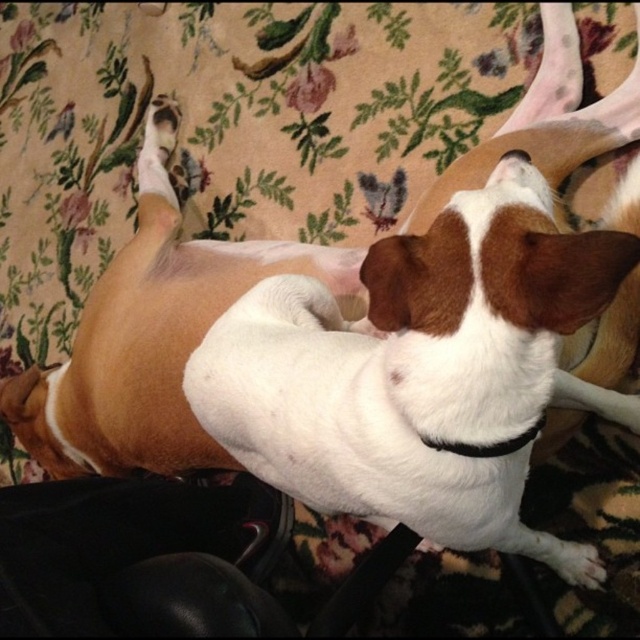
Question: Is white fur dog at center smaller than black fabric neckband at center?

Choices:
 (A) no
 (B) yes

Answer: (A)

Question: Where is white fur dog at center located in relation to black fabric neckband at center in the image?

Choices:
 (A) left
 (B) right

Answer: (A)

Question: Which of the following is the farthest from the observer?

Choices:
 (A) black fabric neckband at center
 (B) white fur dog at center

Answer: (A)

Question: Which of the following is the farthest from the observer?

Choices:
 (A) tap(493, 451)
 (B) tap(477, 282)

Answer: (A)

Question: Does white fur dog at center appear on the left side of black fabric neckband at center?

Choices:
 (A) yes
 (B) no

Answer: (A)

Question: Among these points, which one is farthest from the camera?

Choices:
 (A) (465, 448)
 (B) (480, 464)

Answer: (B)